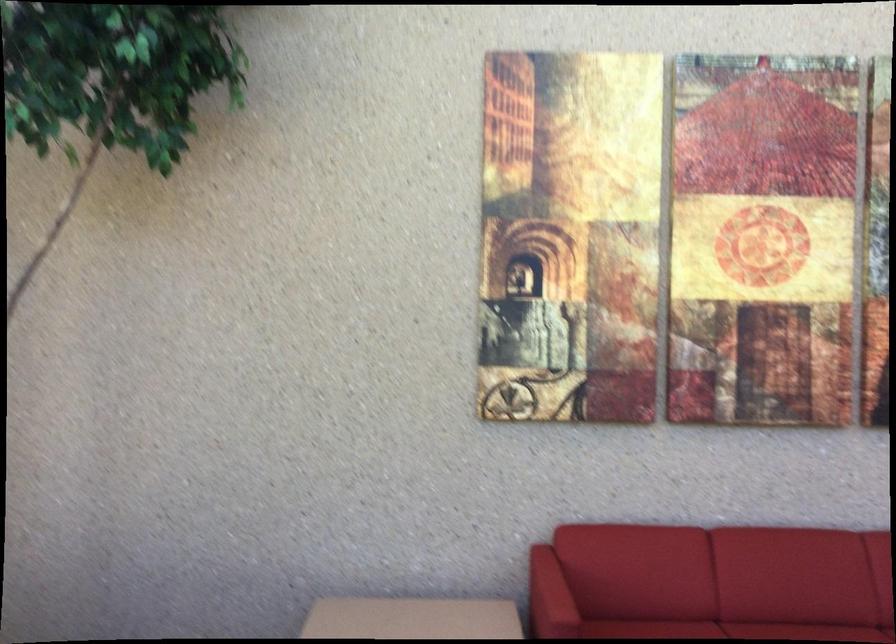
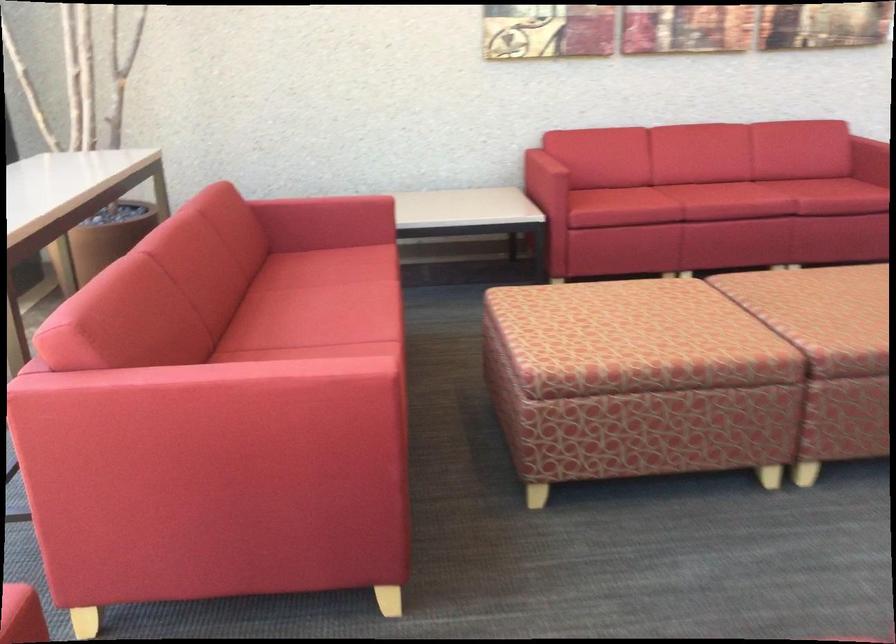
Which direction would the cameraman need to move to produce the second image?

The cameraman moved toward left, backward.